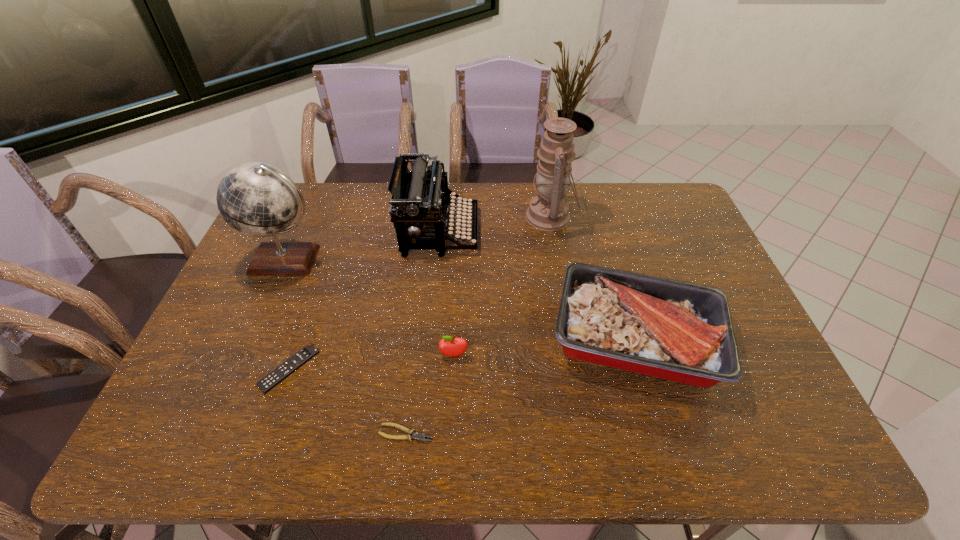
This screenshot has height=540, width=960. What are the coordinates of `free area in between the nearest object and the globe` in the screenshot? It's located at (347, 346).

This screenshot has width=960, height=540. Identify the location of empty location between the nearest object and the fifth tallest object. (430, 394).

You are a GUI agent. You are given a task and a screenshot of the screen. Output one action in this format:
    pyautogui.click(x=<x>, y=<y>)
    Task: Click on the third closest object to the globe
    The width and height of the screenshot is (960, 540).
    Given the screenshot: What is the action you would take?
    pyautogui.click(x=449, y=346)

Point out which object is positioned as the sixth nearest to the oil lamp. Please provide its 2D coordinates. Your answer should be formatted as a tuple, i.e. [(x, y)], where the tuple contains the x and y coordinates of a point satisfying the conditions above.

[(308, 352)]

Where is `vacant point that satisfies the following two spatial constraints: 1. on the front side of the oil lamp; 2. on the left side of the fourth shortest object`? The width and height of the screenshot is (960, 540). vacant point that satisfies the following two spatial constraints: 1. on the front side of the oil lamp; 2. on the left side of the fourth shortest object is located at coordinates (572, 338).

Locate an element on the screen. Image resolution: width=960 pixels, height=540 pixels. vacant region that satisfies the following two spatial constraints: 1. at the equator of the apple; 2. on the left side of the globe is located at coordinates (246, 355).

Where is `free space that satisfies the following two spatial constraints: 1. at the equator of the globe; 2. on the right side of the fifth tallest object`? free space that satisfies the following two spatial constraints: 1. at the equator of the globe; 2. on the right side of the fifth tallest object is located at coordinates (246, 355).

The width and height of the screenshot is (960, 540). Find the location of `free space that satisfies the following two spatial constraints: 1. on the back side of the nearest object; 2. on the left side of the tray`. free space that satisfies the following two spatial constraints: 1. on the back side of the nearest object; 2. on the left side of the tray is located at coordinates (418, 338).

Identify the location of free spot that satisfies the following two spatial constraints: 1. on the typing side of the typewriter; 2. on the back side of the tray. (428, 338).